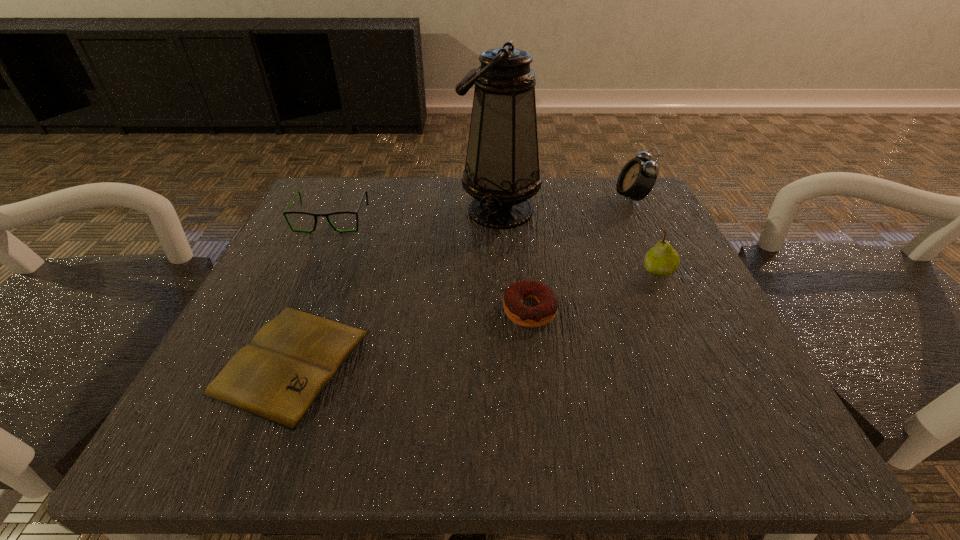
I want to click on free space between the oil lamp and the book, so click(396, 286).

Where is `vacant point located between the tallest object and the pear`? Image resolution: width=960 pixels, height=540 pixels. vacant point located between the tallest object and the pear is located at coordinates [x=579, y=241].

Image resolution: width=960 pixels, height=540 pixels. Find the location of `the fourth closest object to the tallest object`. the fourth closest object to the tallest object is located at coordinates (285, 212).

The width and height of the screenshot is (960, 540). I want to click on the second closest object to the tallest object, so click(x=637, y=178).

Where is `vacant space that satisfies the following two spatial constraints: 1. on the face of the alarm clock; 2. on the front side of the tallest object`? This screenshot has width=960, height=540. vacant space that satisfies the following two spatial constraints: 1. on the face of the alarm clock; 2. on the front side of the tallest object is located at coordinates (637, 211).

Find the location of a particular element. The width and height of the screenshot is (960, 540). vacant space that satisfies the following two spatial constraints: 1. on the back side of the book; 2. on the left side of the oil lamp is located at coordinates (352, 211).

Where is `free space that satisfies the following two spatial constraints: 1. on the face of the second tallest object; 2. on the lens of the third shortest object`? This screenshot has width=960, height=540. free space that satisfies the following two spatial constraints: 1. on the face of the second tallest object; 2. on the lens of the third shortest object is located at coordinates (642, 220).

The height and width of the screenshot is (540, 960). I want to click on free space that satisfies the following two spatial constraints: 1. on the back side of the doughnut; 2. on the right side of the pear, so [525, 271].